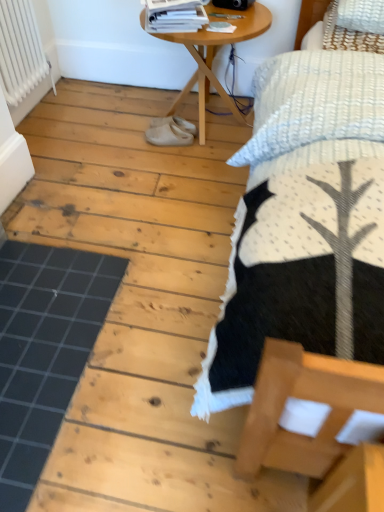
Where is `wooden table at center`? The height and width of the screenshot is (512, 384). wooden table at center is located at coordinates (213, 57).

The height and width of the screenshot is (512, 384). Identify the location of white suede shoes at center, placed as the first footwear when sorted from top to bottom. (175, 124).

Measure the distance between point (167, 25) and camera.

Point (167, 25) is 1.83 meters away from camera.

The height and width of the screenshot is (512, 384). Find the location of `white textured bed at upper right`. white textured bed at upper right is located at coordinates (305, 223).

What do you see at coordinates (44, 350) in the screenshot? I see `black rubber mat at lower left` at bounding box center [44, 350].

Locate an element on the screen. wooden table at center is located at coordinates (213, 57).

Considering the positions of objects white suede shoes at center, the 2th footwear from the bottom, and white glossy magazine at upper center in the image provided, who is behind, white suede shoes at center, the 2th footwear from the bottom, or white glossy magazine at upper center?

Positioned behind is white suede shoes at center, the 2th footwear from the bottom.

Based on the photo, what's the angular difference between white suede shoes at center, the 2th footwear from the bottom, and white glossy magazine at upper center's facing directions?

There is a 107-degree angle between the facing directions of white suede shoes at center, the 2th footwear from the bottom, and white glossy magazine at upper center.

Which is less distant, [181,118] or [152,25]?

Point [152,25]

Between wooden table at center and white suede shoes at center, the 2th footwear from the bottom, which one has more height?

wooden table at center is taller.

How many degrees apart are the facing directions of wooden table at center and white suede shoes at center, the 2th footwear from the bottom?

wooden table at center and white suede shoes at center, the 2th footwear from the bottom, are facing 84.8 degrees away from each other.

Measure the distance between wooden table at center and white suede shoes at center, the 2th footwear from the bottom.

33.93 centimeters.

Is wooden table at center thinner than white suede shoes at center, placed as the first footwear when sorted from top to bottom?

No, wooden table at center is not thinner than white suede shoes at center, placed as the first footwear when sorted from top to bottom.

Is wooden table at center in front of white painted metal radiator at upper left?

Yes, it is in front of white painted metal radiator at upper left.

Is wooden table at center at the left side of white painted metal radiator at upper left?

In fact, wooden table at center is to the right of white painted metal radiator at upper left.

Find the location of `table that is in front of the white painted metal radiator at upper left`. table that is in front of the white painted metal radiator at upper left is located at coordinates (213, 57).

Does point (200, 35) appear closer or farther from the camera than point (46, 63)?

Clearly, point (200, 35) is closer to the camera than point (46, 63).

Consider the image. Is white glossy magazine at upper center wider than white suede shoes at center, placed as the first footwear when sorted from top to bottom?

Indeed, white glossy magazine at upper center has a greater width compared to white suede shoes at center, placed as the first footwear when sorted from top to bottom.

From the image's perspective, is white glossy magazine at upper center located above white suede shoes at center, placed as the first footwear when sorted from top to bottom?

Yes, from the image's perspective, white glossy magazine at upper center is over white suede shoes at center, placed as the first footwear when sorted from top to bottom.

Considering the relative positions of white glossy magazine at upper center and white suede shoes at center, the 2th footwear from the bottom, in the image provided, is white glossy magazine at upper center behind white suede shoes at center, the 2th footwear from the bottom,?

No, it is in front of white suede shoes at center, the 2th footwear from the bottom.

From a real-world perspective, who is located higher, white glossy magazine at upper center or white suede shoes at center, placed as the first footwear when sorted from top to bottom?

white glossy magazine at upper center is physically above.

Which object is positioned more to the left, white rubber shoes at center, arranged as the 2th footwear when viewed from the top, or white textured bed at upper right?

white rubber shoes at center, arranged as the 2th footwear when viewed from the top.

Is white rubber shoes at center, arranged as the 2th footwear when viewed from the top, placed right next to white textured bed at upper right?

No, white rubber shoes at center, arranged as the 2th footwear when viewed from the top, is not in contact with white textured bed at upper right.

Is point (185, 140) positioned behind point (307, 68)?

Yes, it is behind point (307, 68).

Based on the photo, what's the angular difference between black rubber mat at lower left and white suede shoes at center, placed as the first footwear when sorted from top to bottom,'s facing directions?

They differ by 174 degrees in their facing directions.

Considering the points (55, 255) and (180, 128), which point is behind, point (55, 255) or point (180, 128)?

Point (180, 128)

In the scene shown: From the image's perspective, is black rubber mat at lower left above or below white suede shoes at center, the 2th footwear from the bottom?

Based on their image positions, black rubber mat at lower left is located beneath white suede shoes at center, the 2th footwear from the bottom.

From the picture: From a real-world perspective, is white textured bed at upper right positioned under white glossy magazine at upper center based on gravity?

Yes, from a real-world perspective, white textured bed at upper right is below white glossy magazine at upper center.

Based on the photo, is white textured bed at upper right aimed at white glossy magazine at upper center?

No, white textured bed at upper right is not aimed at white glossy magazine at upper center.

Choose the correct answer: Is white textured bed at upper right inside white glossy magazine at upper center or outside it?

white textured bed at upper right is outside white glossy magazine at upper center.

Are white textured bed at upper right and white glossy magazine at upper center making contact?

They are not placed beside each other.

Identify the location of magazine that appears above the white suede shoes at center, the 2th footwear from the bottom (from the image's perspective). (174, 16).

From the wooden table at center, count 2nd footwears backward and point to it. Please provide its 2D coordinates.

[(175, 124)]

Looking at the image, which one is located further to white painted metal radiator at upper left, white rubber shoes at center, arranged as the 2th footwear when viewed from the top, or white textured bed at upper right?

Among the two, white textured bed at upper right is located further to white painted metal radiator at upper left.

Which object lies nearer to the anchor point white suede shoes at center, placed as the first footwear when sorted from top to bottom, wooden table at center or white rubber shoes at center, arranged as the 2th footwear when viewed from the top?

Among the two, white rubber shoes at center, arranged as the 2th footwear when viewed from the top, is located nearer to white suede shoes at center, placed as the first footwear when sorted from top to bottom.

Looking at the image, which one is located closer to white suede shoes at center, the 2th footwear from the bottom, white glossy magazine at upper center or white textured bed at upper right?

Based on the image, white glossy magazine at upper center appears to be nearer to white suede shoes at center, the 2th footwear from the bottom.

Considering their positions, is white textured bed at upper right positioned closer to white painted metal radiator at upper left than wooden table at center?

wooden table at center.

From the image, which object appears to be farther from white suede shoes at center, placed as the first footwear when sorted from top to bottom, black rubber mat at lower left or white painted metal radiator at upper left?

The object further to white suede shoes at center, placed as the first footwear when sorted from top to bottom, is black rubber mat at lower left.

Estimate the real-world distances between objects in this image. Which object is further from white textured bed at upper right, white suede shoes at center, the 2th footwear from the bottom, or wooden table at center?

Based on the image, white suede shoes at center, the 2th footwear from the bottom, appears to be further to white textured bed at upper right.

Looking at the image, which one is located further to white textured bed at upper right, wooden table at center or white painted metal radiator at upper left?

Among the two, white painted metal radiator at upper left is located further to white textured bed at upper right.

Looking at the image, which one is located closer to white glossy magazine at upper center, black rubber mat at lower left or white painted metal radiator at upper left?

Based on the image, white painted metal radiator at upper left appears to be nearer to white glossy magazine at upper center.

Image resolution: width=384 pixels, height=512 pixels. In order to click on plank located between white textured bed at upper right and white rubber shoes at center, arranged as the 2th footwear when viewed from the top, in the depth direction in this screenshot , I will do `click(44, 350)`.

Locate an element on the screen. This screenshot has height=512, width=384. radiator between white textured bed at upper right and white suede shoes at center, placed as the first footwear when sorted from top to bottom, from front to back is located at coordinates (21, 51).

Locate an element on the screen. The width and height of the screenshot is (384, 512). magazine located between white textured bed at upper right and wooden table at center in the depth direction is located at coordinates (x=174, y=16).

Where is `footwear between white painted metal radiator at upper left and white suede shoes at center, the 2th footwear from the bottom, in the horizontal direction`? Image resolution: width=384 pixels, height=512 pixels. footwear between white painted metal radiator at upper left and white suede shoes at center, the 2th footwear from the bottom, in the horizontal direction is located at coordinates (171, 134).